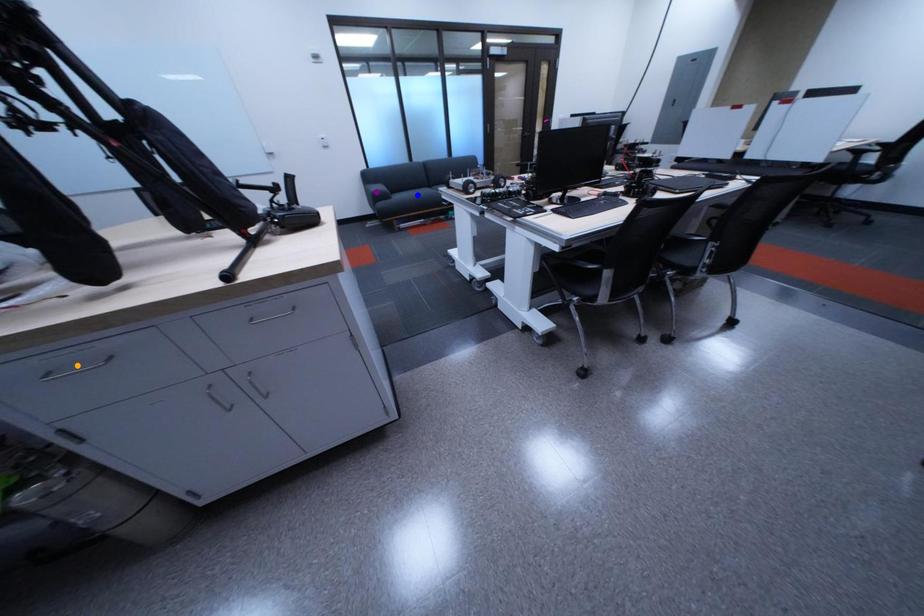
Order these from farthest to nearest:
1. purple point
2. orange point
3. blue point

blue point < purple point < orange point